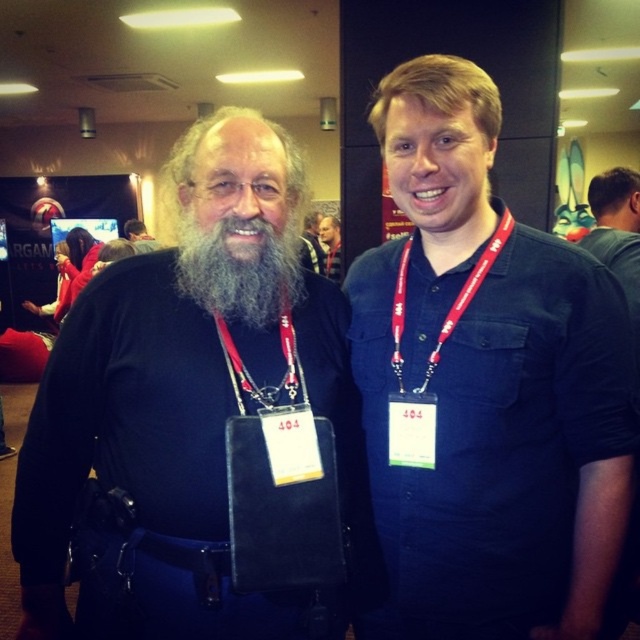
Looking at this image, you are a photographer at the event and want to ensure both the matte blue shirt at center and the red fabric lanyard at center are clearly visible in your photo. Given their relative heights, which one might you need to adjust your camera angle to focus on?

The matte blue shirt at center has a lesser height compared to the red fabric lanyard at center, so you might need to lower your camera angle slightly to ensure the matte blue shirt at center is in focus while still capturing the red fabric lanyard at center.

You are at a convention and need to locate the matte blue shirt at center and the gray beard at center. Which one is located lower in the image?

The matte blue shirt at center is positioned under gray beard at center, so the matte blue shirt at center is lower in the image.

You are organizing a photo shoot and need to ensure that all participants wear items that are proportionate to their bodies. Given the scene described, which item between the matte blue shirt at center and the red fabric lanyard at center is more appropriately sized for the person wearing them?

The red fabric lanyard at center is more appropriately sized because it is larger than the matte blue shirt at center, which is smaller than it.